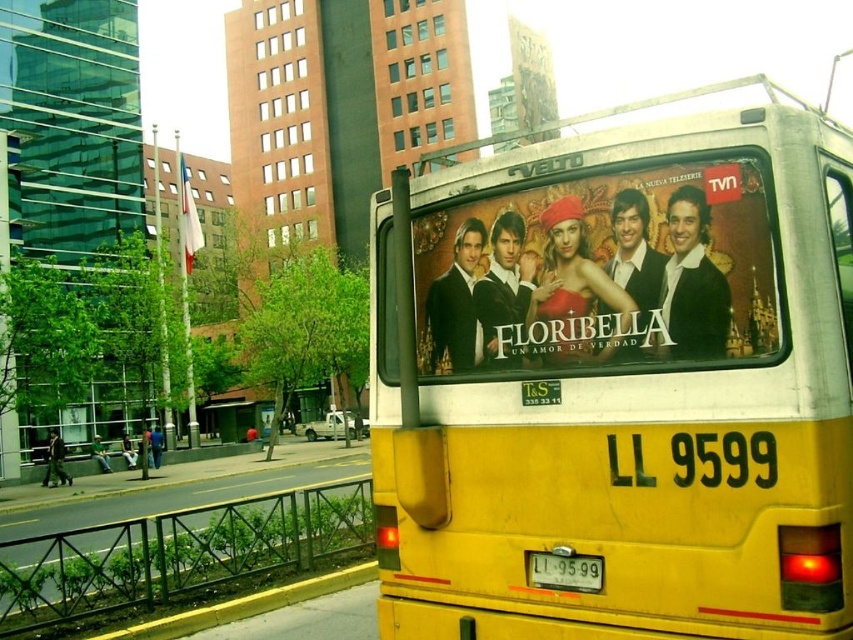
Question: Observing the image, what is the correct spatial positioning of yellow matte bus at center in reference to matte black poster at center?

Choices:
 (A) right
 (B) left

Answer: (B)

Question: Can you confirm if yellow matte bus at center is smaller than matte black poster at center?

Choices:
 (A) yes
 (B) no

Answer: (B)

Question: Which object is farther from the camera taking this photo?

Choices:
 (A) white plastic license plate at center
 (B) yellow matte bus at center

Answer: (A)

Question: Which object appears farthest from the camera in this image?

Choices:
 (A) matte black poster at center
 (B) white plastic license plate at center
 (C) yellow matte bus at center

Answer: (B)

Question: Does matte black poster at center lie in front of white plastic license plate at center?

Choices:
 (A) no
 (B) yes

Answer: (B)

Question: Which object is positioned farthest from the yellow matte bus at center?

Choices:
 (A) white plastic license plate at center
 (B) matte black poster at center

Answer: (A)